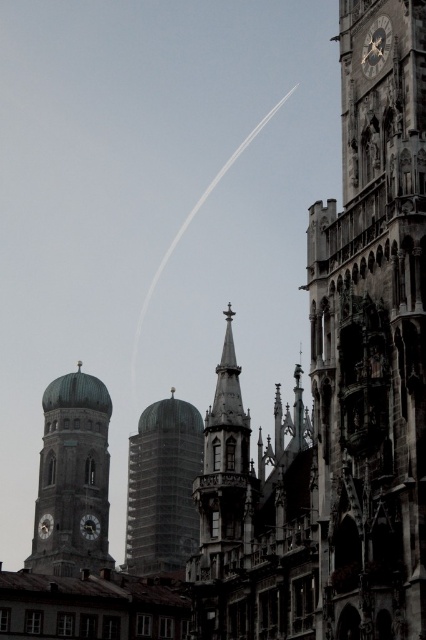
I want to click on dark gray stone clock at upper right, so (376, 45).

Can you confirm if dark gray stone clock at upper right is thinner than matte gold clock at left?

Incorrect, dark gray stone clock at upper right's width is not less than matte gold clock at left's.

Who is more distant from viewer, (x=382, y=26) or (x=43, y=513)?

Point (x=43, y=513)

Find the location of a particular element. This screenshot has width=426, height=640. dark gray stone clock at upper right is located at coordinates (376, 45).

Is point (359, 371) positioned before point (227, 364)?

That is True.

Is stone clock tower at right bigger than polished stone spire at center?

Indeed, stone clock tower at right has a larger size compared to polished stone spire at center.

Between point (388, 353) and point (209, 515), which one is positioned behind?

Positioned behind is point (209, 515).

Identify the location of stone clock tower at right. click(373, 340).

Is point (137, 540) positioned in front of point (368, 65)?

No.

Who is higher up, transparent glass tower at center or dark gray stone clock at upper right?

dark gray stone clock at upper right is higher up.

Which is in front, point (137, 515) or point (371, 44)?

Point (371, 44) is in front.

You are a GUI agent. You are given a task and a screenshot of the screen. Output one action in this format:
    pyautogui.click(x=<x>, y=<y>)
    Task: Click on the transparent glass tower at center
    This screenshot has height=640, width=426.
    Given the screenshot: What is the action you would take?
    pyautogui.click(x=163, y=486)